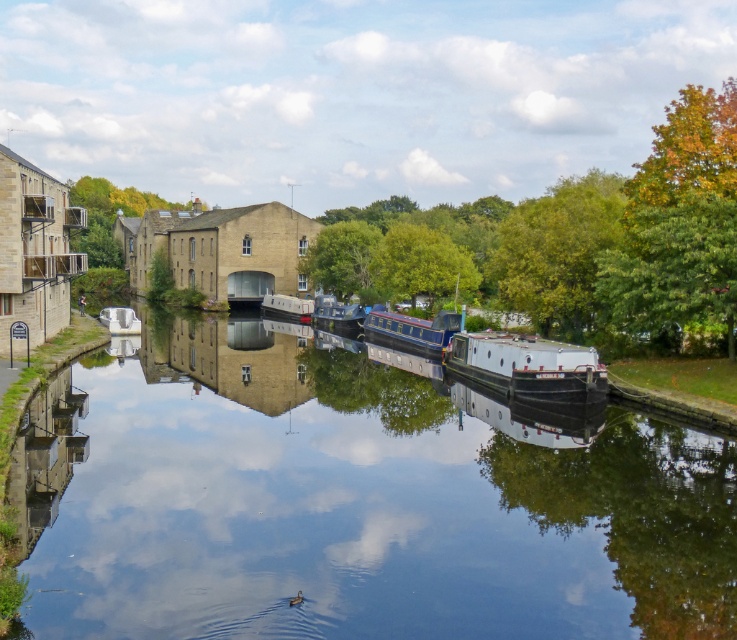
Question: Which object is closer to the camera taking this photo?

Choices:
 (A) clear water at center
 (B) white glossy canal boat at center
 (C) metallic silver boat at left

Answer: (A)

Question: Does white matte boat at center appear over metallic silver boat at left?

Choices:
 (A) yes
 (B) no

Answer: (B)

Question: Is white matte boat at center smaller than metallic blue boat at center?

Choices:
 (A) yes
 (B) no

Answer: (A)

Question: Is white matte boat at center closer to camera compared to white glossy canal boat at center?

Choices:
 (A) yes
 (B) no

Answer: (A)

Question: Among these objects, which one is nearest to the camera?

Choices:
 (A) white glossy canal boat at center
 (B) metallic silver boat at left
 (C) white matte boat at center
 (D) clear water at center

Answer: (D)

Question: Which of the following is the closest to the observer?

Choices:
 (A) (357, 305)
 (B) (444, 323)

Answer: (B)